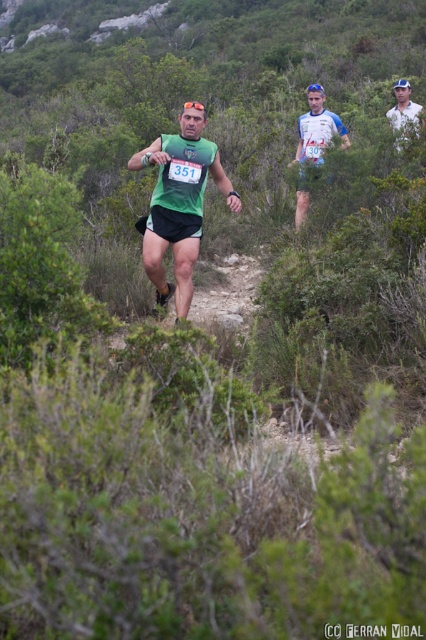
Based on the photo, measure the distance between green matte running vest at center and matte green tank top at center.

A distance of 8.85 feet exists between green matte running vest at center and matte green tank top at center.

Between point (155, 259) and point (305, 164), which one is positioned behind?

Point (305, 164)

Is point (198, 152) positioned behind point (307, 198)?

No.

Locate an element on the screen. The image size is (426, 640). green matte running vest at center is located at coordinates (180, 202).

Does green matte running vest at center have a greater height compared to white cotton shirt at upper right?

Correct, green matte running vest at center is much taller as white cotton shirt at upper right.

Can you confirm if green matte running vest at center is thinner than white cotton shirt at upper right?

No.

Is point (195, 228) in front of point (396, 120)?

Yes, point (195, 228) is closer to viewer.

Image resolution: width=426 pixels, height=640 pixels. What are the coordinates of `green matte running vest at center` in the screenshot? It's located at (180, 202).

Is matte green tank top at center smaller than white cotton shirt at upper right?

No, matte green tank top at center is not smaller than white cotton shirt at upper right.

Is point (307, 124) positioned before point (408, 108)?

Yes, point (307, 124) is in front of point (408, 108).

You are a GUI agent. You are given a task and a screenshot of the screen. Output one action in this format:
    pyautogui.click(x=<x>, y=<y>)
    Task: Click on the matte green tank top at center
    Image resolution: width=426 pixels, height=640 pixels.
    Given the screenshot: What is the action you would take?
    pyautogui.click(x=313, y=144)